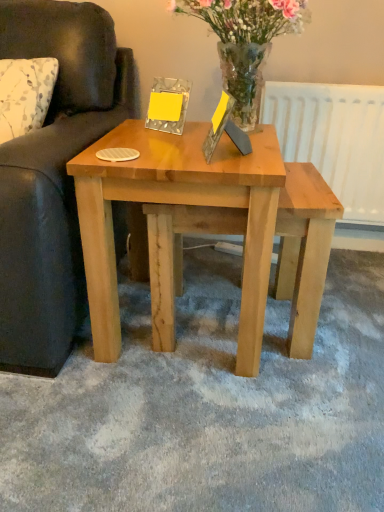
Locate an element on the screen. This screenshot has height=512, width=384. free point above natural wood coffee table at center (from a real-world perspective) is located at coordinates (170, 137).